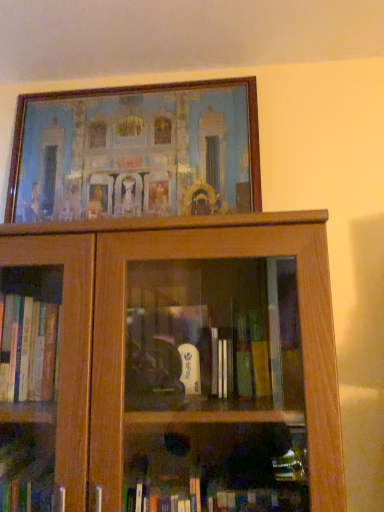
Locate an element on the screen. wooden picture frame at upper center is located at coordinates (136, 150).

What do you see at coordinates (136, 150) in the screenshot?
I see `wooden picture frame at upper center` at bounding box center [136, 150].

The height and width of the screenshot is (512, 384). Identify the location of wooden picture frame at upper center. (136, 150).